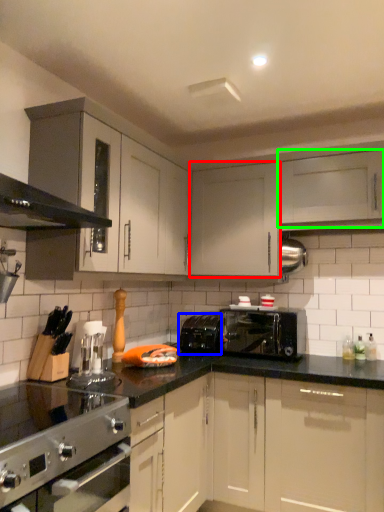
Question: Which object is the farthest from cabinetry (highlighted by a red box)? Choose among these: appliance (highlighted by a blue box) or cabinetry (highlighted by a green box).

Choices:
 (A) appliance
 (B) cabinetry

Answer: (A)